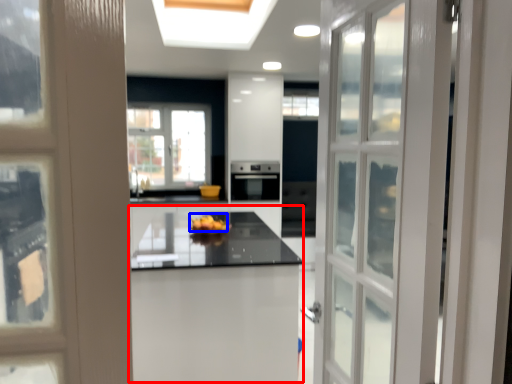
Question: Among these objects, which one is farthest to the camera, table (highlighted by a red box) or fruit (highlighted by a blue box)?

Choices:
 (A) table
 (B) fruit

Answer: (B)